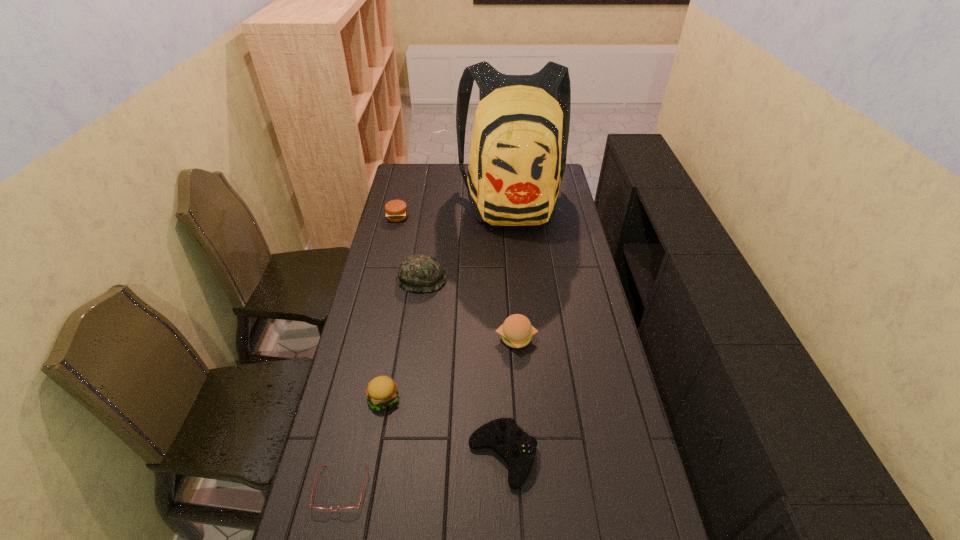
Identify the location of the tallest object. The image size is (960, 540). (518, 151).

This screenshot has width=960, height=540. I want to click on the fifth nearest object, so click(418, 273).

Locate an element on the screen. the tallest hamburger is located at coordinates (516, 331).

I want to click on the second farthest hamburger, so click(x=516, y=331).

Where is `the farthest hamburger`? the farthest hamburger is located at coordinates (396, 210).

The width and height of the screenshot is (960, 540). I want to click on the nearest hamburger, so click(x=382, y=391).

Locate an element on the screen. The width and height of the screenshot is (960, 540). control is located at coordinates (518, 449).

Locate an element on the screen. The width and height of the screenshot is (960, 540). spectacles is located at coordinates (348, 509).

Identify the location of vacant space located 0.050m on the front-facing side of the tallest object. This screenshot has width=960, height=540. (516, 248).

Locate an element on the screen. Image resolution: width=960 pixels, height=540 pixels. free space located on the right of the fifth nearest object is located at coordinates (519, 279).